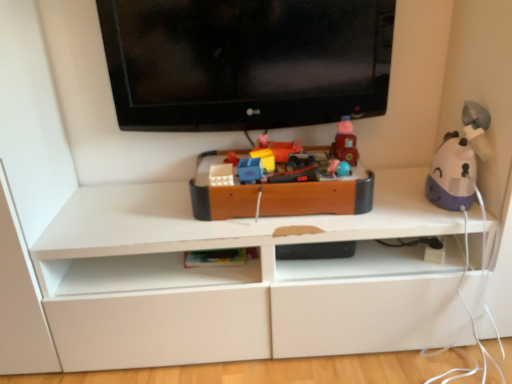
The width and height of the screenshot is (512, 384). Find the location of `blank area to the left of matte plastic toy car at center, the 3th toy positioned from the left`. blank area to the left of matte plastic toy car at center, the 3th toy positioned from the left is located at coordinates (214, 167).